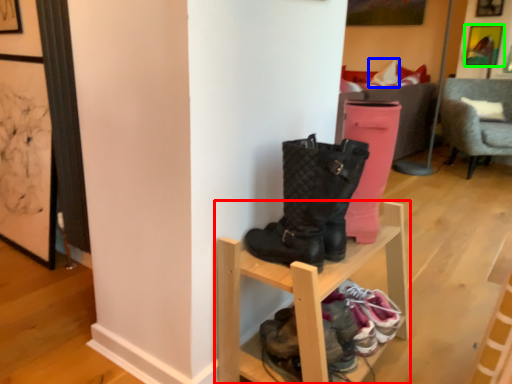
Question: Considering the real-world distances, which object is closest to shelf (highlighted by a red box)? pillow (highlighted by a blue box) or picture frame (highlighted by a green box).

Choices:
 (A) pillow
 (B) picture frame

Answer: (A)